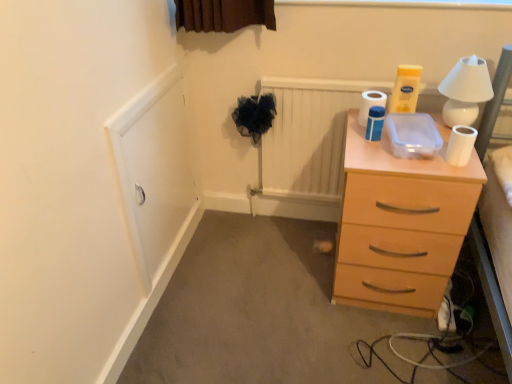
Question: Is white matte toilet paper at upper right, the 2th toilet paper from the back, further to the viewer compared to white matte toilet paper at upper right, which ranks as the third toilet paper in left-to-right order?

Choices:
 (A) no
 (B) yes

Answer: (B)

Question: From a real-world perspective, is white matte toilet paper at upper right, the third toilet paper in the right-to-left sequence, on top of white matte toilet paper at upper right, positioned as the 1th toilet paper in right-to-left order?

Choices:
 (A) no
 (B) yes

Answer: (B)

Question: Is white matte toilet paper at upper right, the 2th toilet paper from the back, outside white matte toilet paper at upper right, positioned as the 1th toilet paper in right-to-left order?

Choices:
 (A) no
 (B) yes

Answer: (B)

Question: Is white matte toilet paper at upper right, the 1th toilet paper in the left-to-right sequence, taller than white matte toilet paper at upper right, the first toilet paper viewed from the front?

Choices:
 (A) yes
 (B) no

Answer: (A)

Question: From the image's perspective, is white matte toilet paper at upper right, the 2th toilet paper from the back, located above white matte toilet paper at upper right, marked as the third toilet paper in a back-to-front arrangement?

Choices:
 (A) no
 (B) yes

Answer: (B)

Question: Is white matte toilet paper at upper right, the 1th toilet paper in the left-to-right sequence, at the left side of white matte toilet paper at upper right, positioned as the 1th toilet paper in right-to-left order?

Choices:
 (A) no
 (B) yes

Answer: (B)

Question: Can you confirm if white ceramic table lamp at upper right is wider than light wood chest of drawers at right?

Choices:
 (A) no
 (B) yes

Answer: (A)

Question: From a real-world perspective, is white ceramic table lamp at upper right positioned under light wood chest of drawers at right based on gravity?

Choices:
 (A) no
 (B) yes

Answer: (A)

Question: Is white ceramic table lamp at upper right shorter than light wood chest of drawers at right?

Choices:
 (A) no
 (B) yes

Answer: (B)

Question: Is white ceramic table lamp at upper right in contact with light wood chest of drawers at right?

Choices:
 (A) yes
 (B) no

Answer: (B)

Question: From the image's perspective, would you say white ceramic table lamp at upper right is positioned over light wood chest of drawers at right?

Choices:
 (A) no
 (B) yes

Answer: (B)

Question: Is white ceramic table lamp at upper right positioned in front of light wood chest of drawers at right?

Choices:
 (A) yes
 (B) no

Answer: (B)

Question: From the image's perspective, does light wood chest of drawers at right appear higher than white ceramic table lamp at upper right?

Choices:
 (A) no
 (B) yes

Answer: (A)